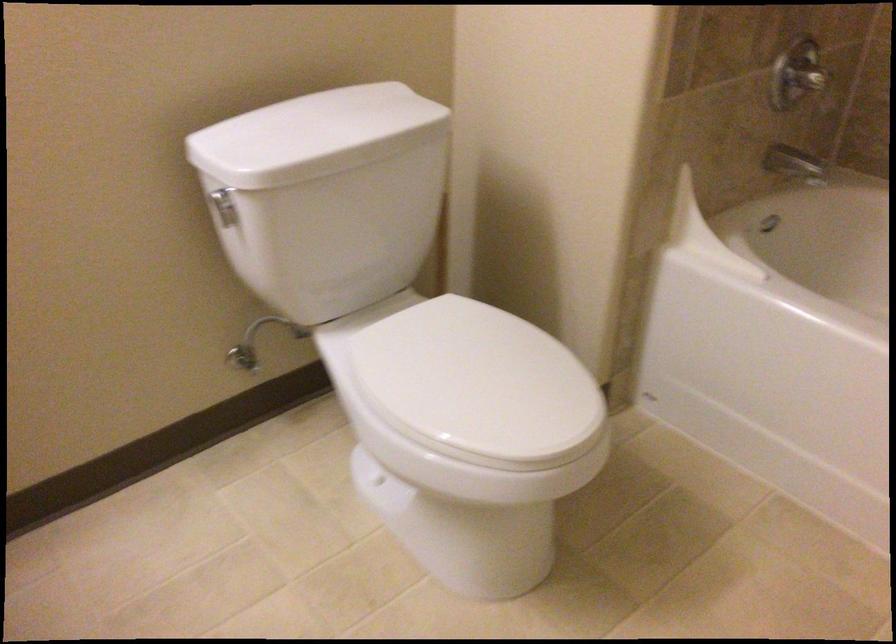
What do you see at coordinates (785, 77) in the screenshot?
I see `a shower faucet handle` at bounding box center [785, 77].